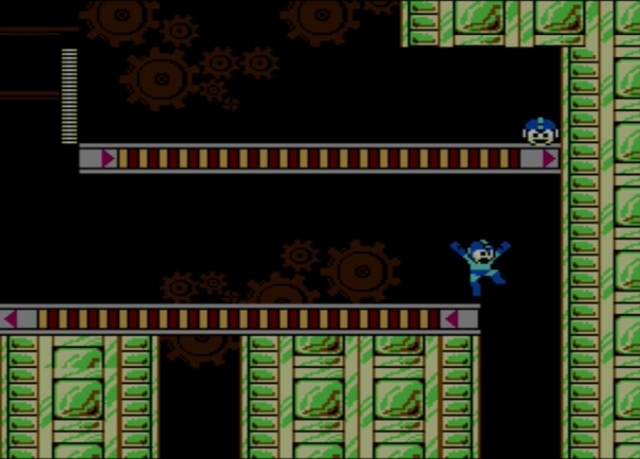
Image resolution: width=640 pixels, height=459 pixels. In order to click on green wall in this screenshot , I will do [608, 300].